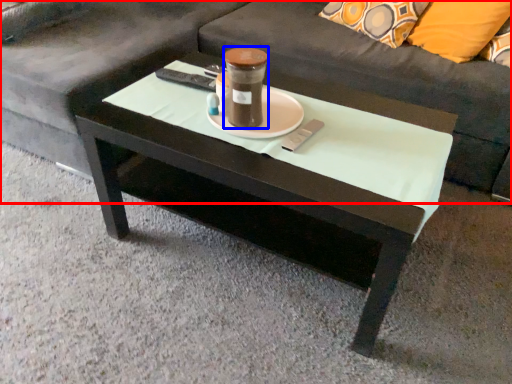
Question: Among these objects, which one is nearest to the camera, studio couch (highlighted by a red box) or beverage (highlighted by a blue box)?

Choices:
 (A) studio couch
 (B) beverage

Answer: (B)